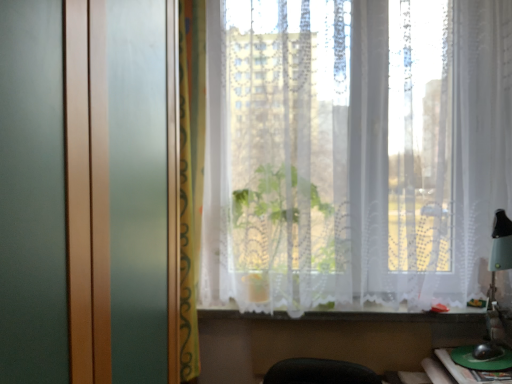
The image size is (512, 384). Identify the location of white lace curtain at center, the 1th curtain viewed from the right. [x=354, y=152].

Image resolution: width=512 pixels, height=384 pixels. What do you see at coordinates (397, 315) in the screenshot?
I see `white lace curtain at lower center` at bounding box center [397, 315].

Identify the location of green plastic table at lower right. (445, 372).

From the image's perspective, which one is positioned lower, white lace curtain at center, acting as the 2th curtain starting from the left, or white lace curtain at lower center?

white lace curtain at lower center appears lower in the image.

Does white lace curtain at center, acting as the 2th curtain starting from the left, appear on the right side of white lace curtain at lower center?

Yes, white lace curtain at center, acting as the 2th curtain starting from the left, is to the right of white lace curtain at lower center.

From a real-world perspective, is white lace curtain at center, acting as the 2th curtain starting from the left, physically located above or below white lace curtain at lower center?

In terms of real-world spatial position, white lace curtain at center, acting as the 2th curtain starting from the left, is above white lace curtain at lower center.

Is white lace curtain at lower center spatially inside green plastic table at lower right, or outside of it?

white lace curtain at lower center cannot be found inside green plastic table at lower right.

How different are the orientations of white lace curtain at lower center and green plastic table at lower right in degrees?

The angle between the facing direction of white lace curtain at lower center and the facing direction of green plastic table at lower right is 89.3 degrees.

Based on the photo, is white lace curtain at lower center positioned far away from green plastic table at lower right?

white lace curtain at lower center is actually quite close to green plastic table at lower right.

Measure the distance between white lace curtain at lower center and green plastic table at lower right.

white lace curtain at lower center and green plastic table at lower right are 27.64 centimeters apart.

Is yellow fabric curtain at center, placed as the 2th curtain when sorted from right to left, located outside green plastic table at lower right?

Indeed, yellow fabric curtain at center, placed as the 2th curtain when sorted from right to left, is completely outside green plastic table at lower right.

From the picture: Is yellow fabric curtain at center, placed as the 2th curtain when sorted from right to left, aimed at green plastic table at lower right?

No, yellow fabric curtain at center, placed as the 2th curtain when sorted from right to left, is not oriented towards green plastic table at lower right.

Find the location of a particular element. the 1st curtain above the green plastic table at lower right (from the image's perspective) is located at coordinates (191, 175).

From the image's perspective, which object appears higher, yellow fabric curtain at center, placed as the 2th curtain when sorted from right to left, or green plastic table at lower right?

yellow fabric curtain at center, placed as the 2th curtain when sorted from right to left, appears higher in the image.

Is green plastic table at lower right to the left or to the right of yellow fabric curtain at center, which is counted as the 1th curtain, starting from the left, in the image?

In the image, green plastic table at lower right appears on the right side of yellow fabric curtain at center, which is counted as the 1th curtain, starting from the left.

Between green plastic table at lower right and yellow fabric curtain at center, which is counted as the 1th curtain, starting from the left, which one has larger width?

Wider between the two is green plastic table at lower right.

Would you say yellow fabric curtain at center, placed as the 2th curtain when sorted from right to left, is part of green plastic table at lower right's contents?

No.

Is green plastic table at lower right positioned with its back to yellow fabric curtain at center, placed as the 2th curtain when sorted from right to left?

green plastic table at lower right does not have its back to yellow fabric curtain at center, placed as the 2th curtain when sorted from right to left.

Which is in front, point (183, 190) or point (400, 314)?

The point (183, 190) is more forward.

I want to click on window sill located on the right of yellow fabric curtain at center, placed as the 2th curtain when sorted from right to left, so click(397, 315).

Is yellow fabric curtain at center, which is counted as the 1th curtain, starting from the left, smaller than white lace curtain at lower center?

No.

Between green plastic table at lower right and white lace curtain at lower center, which one is positioned behind?

white lace curtain at lower center is further away from the camera.

From the image's perspective, who appears lower, green plastic table at lower right or white lace curtain at lower center?

green plastic table at lower right is shown below in the image.

Considering the sizes of green plastic table at lower right and white lace curtain at lower center in the image, is green plastic table at lower right wider or thinner than white lace curtain at lower center?

In the image, green plastic table at lower right appears to be wider than white lace curtain at lower center.

Is point (459, 366) closer to viewer compared to point (234, 313)?

Yes, point (459, 366) is closer to viewer.

How different are the orientations of white lace curtain at center, acting as the 2th curtain starting from the left, and yellow fabric curtain at center, placed as the 2th curtain when sorted from right to left, in degrees?

white lace curtain at center, acting as the 2th curtain starting from the left, and yellow fabric curtain at center, placed as the 2th curtain when sorted from right to left, are facing 14.1 degrees away from each other.

In the scene shown: From the image's perspective, which object appears higher, white lace curtain at center, acting as the 2th curtain starting from the left, or yellow fabric curtain at center, placed as the 2th curtain when sorted from right to left?

white lace curtain at center, acting as the 2th curtain starting from the left.

Where is `curtain below the white lace curtain at center, acting as the 2th curtain starting from the left (from the image's perspective)`? The width and height of the screenshot is (512, 384). curtain below the white lace curtain at center, acting as the 2th curtain starting from the left (from the image's perspective) is located at coordinates (191, 175).

In the image, is white lace curtain at center, acting as the 2th curtain starting from the left, on the left side or the right side of yellow fabric curtain at center, which is counted as the 1th curtain, starting from the left?

From the image, it's evident that white lace curtain at center, acting as the 2th curtain starting from the left, is to the right of yellow fabric curtain at center, which is counted as the 1th curtain, starting from the left.

At what (x,y) coordinates should I click in order to perform the action: click on the 2nd curtain positioned above the white lace curtain at lower center (from the image's perspective). Please return your answer as a coordinate pair (x, y). The image size is (512, 384). Looking at the image, I should click on (354, 152).

At what (x,y) coordinates should I click in order to perform the action: click on window sill behind the green plastic table at lower right. Please return your answer as a coordinate pair (x, y). The height and width of the screenshot is (384, 512). Looking at the image, I should click on [x=397, y=315].

Based on their spatial positions, is green plastic table at lower right or white lace curtain at center, acting as the 2th curtain starting from the left, closer to white lace curtain at lower center?

Based on the image, green plastic table at lower right appears to be nearer to white lace curtain at lower center.

Which object lies further to the anchor point white lace curtain at lower center, green plastic table at lower right or yellow fabric curtain at center, which is counted as the 1th curtain, starting from the left?

yellow fabric curtain at center, which is counted as the 1th curtain, starting from the left, is positioned further to the anchor white lace curtain at lower center.

Which object lies nearer to the anchor point white lace curtain at lower center, white lace curtain at center, the 1th curtain viewed from the right, or green plastic table at lower right?

The object closer to white lace curtain at lower center is green plastic table at lower right.

Which object lies further to the anchor point white lace curtain at lower center, white lace curtain at center, the 1th curtain viewed from the right, or yellow fabric curtain at center, placed as the 2th curtain when sorted from right to left?

yellow fabric curtain at center, placed as the 2th curtain when sorted from right to left.

Based on their spatial positions, is white lace curtain at lower center or green plastic table at lower right further from white lace curtain at center, the 1th curtain viewed from the right?

green plastic table at lower right is positioned further to the anchor white lace curtain at center, the 1th curtain viewed from the right.

Based on their spatial positions, is yellow fabric curtain at center, placed as the 2th curtain when sorted from right to left, or white lace curtain at lower center closer to green plastic table at lower right?

white lace curtain at lower center is positioned closer to the anchor green plastic table at lower right.

When comparing their distances from green plastic table at lower right, does white lace curtain at lower center or white lace curtain at center, acting as the 2th curtain starting from the left, seem closer?

white lace curtain at lower center is positioned closer to the anchor green plastic table at lower right.

When comparing their distances from white lace curtain at center, the 1th curtain viewed from the right, does white lace curtain at lower center or yellow fabric curtain at center, placed as the 2th curtain when sorted from right to left, seem further?

white lace curtain at lower center is further to white lace curtain at center, the 1th curtain viewed from the right.

The height and width of the screenshot is (384, 512). Identify the location of window sill between white lace curtain at center, the 1th curtain viewed from the right, and green plastic table at lower right in the up-down direction. (397, 315).

Where is `window sill located between yellow fabric curtain at center, which is counted as the 1th curtain, starting from the left, and green plastic table at lower right in the left-right direction`? Image resolution: width=512 pixels, height=384 pixels. window sill located between yellow fabric curtain at center, which is counted as the 1th curtain, starting from the left, and green plastic table at lower right in the left-right direction is located at coordinates (397, 315).

Locate an element on the screen. curtain between yellow fabric curtain at center, which is counted as the 1th curtain, starting from the left, and green plastic table at lower right from left to right is located at coordinates (354, 152).

Locate an element on the screen. The height and width of the screenshot is (384, 512). window sill between yellow fabric curtain at center, which is counted as the 1th curtain, starting from the left, and white lace curtain at center, the 1th curtain viewed from the right, from left to right is located at coordinates (397, 315).